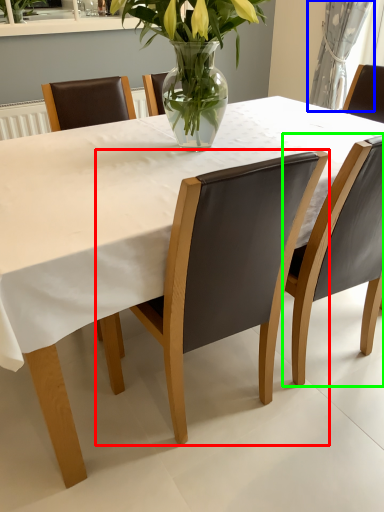
Question: Based on their relative distances, which object is nearer to chair (highlighted by a red box)? Choose from curtain (highlighted by a blue box) and chair (highlighted by a green box).

Choices:
 (A) curtain
 (B) chair

Answer: (B)